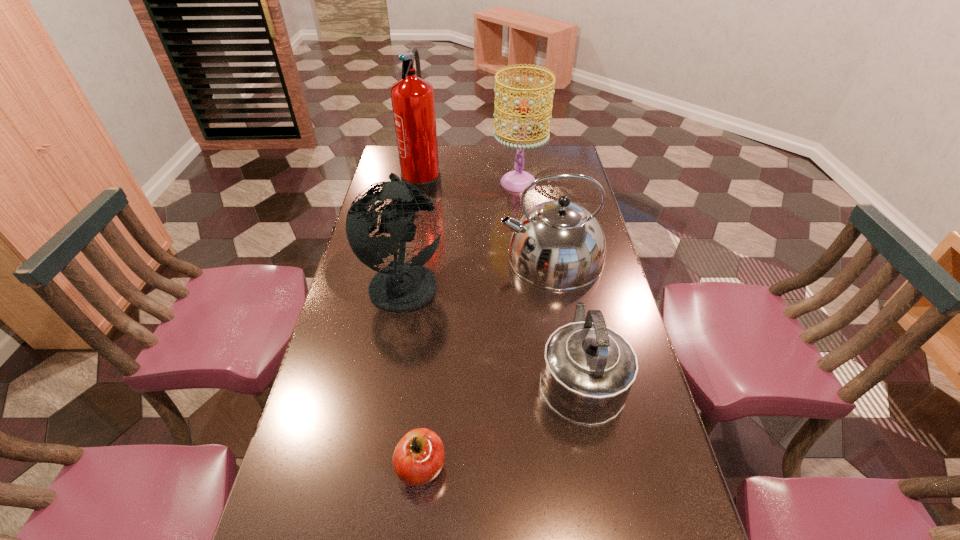
Locate an element on the screen. Image resolution: width=960 pixels, height=540 pixels. empty location between the second shortest object and the tallest object is located at coordinates (501, 276).

Locate an element on the screen. free space between the fire extinguisher and the fifth shortest object is located at coordinates (470, 181).

The width and height of the screenshot is (960, 540). What are the coordinates of `blank region between the farther kettle and the fire extinguisher` in the screenshot? It's located at (487, 218).

The image size is (960, 540). Find the location of `vacant area that lies between the farther kettle and the globe`. vacant area that lies between the farther kettle and the globe is located at coordinates (477, 269).

The height and width of the screenshot is (540, 960). I want to click on vacant space in between the fire extinguisher and the second tallest object, so click(x=470, y=181).

The image size is (960, 540). What are the coordinates of `empty space that is in between the taller kettle and the fire extinguisher` in the screenshot? It's located at (487, 218).

Choose which object is the fourth nearest neighbor to the farther kettle. Please provide its 2D coordinates. Your answer should be formatted as a tuple, i.e. [(x, y)], where the tuple contains the x and y coordinates of a point satisfying the conditions above.

[(412, 97)]

Find the location of a particular element. the closest object to the second tallest object is located at coordinates (558, 245).

At what (x,y) coordinates should I click in order to perform the action: click on vacant position in the image that satisfies the following two spatial constraints: 1. from the spout of the taller kettle; 2. with the spout at the front of the second nearest object. Please return your answer as a coordinate pair (x, y). Looking at the image, I should click on (571, 374).

The image size is (960, 540). Find the location of `vacant area that satisfies the following two spatial constraints: 1. with the spout at the front of the nearer kettle; 2. from the spout of the taller kettle`. vacant area that satisfies the following two spatial constraints: 1. with the spout at the front of the nearer kettle; 2. from the spout of the taller kettle is located at coordinates (558, 257).